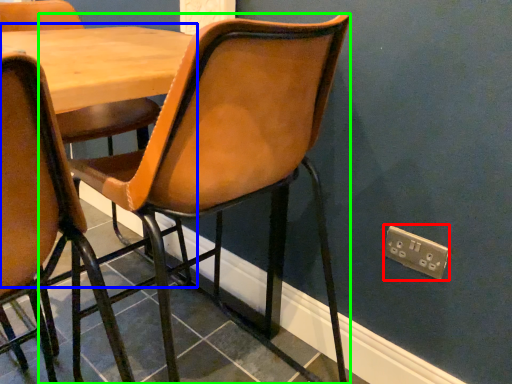
Question: Estimate the real-world distances between objects in this image. Which object is farther from electric outlet (highlighted by a red box), table (highlighted by a blue box) or chair (highlighted by a green box)?

Choices:
 (A) table
 (B) chair

Answer: (A)